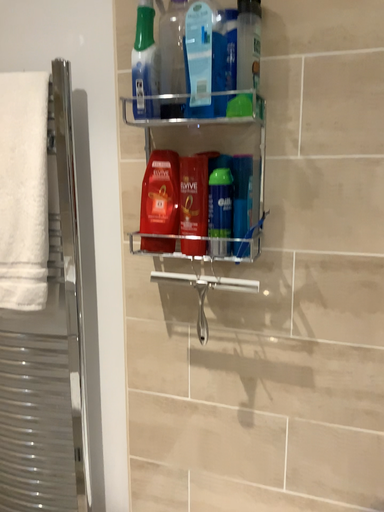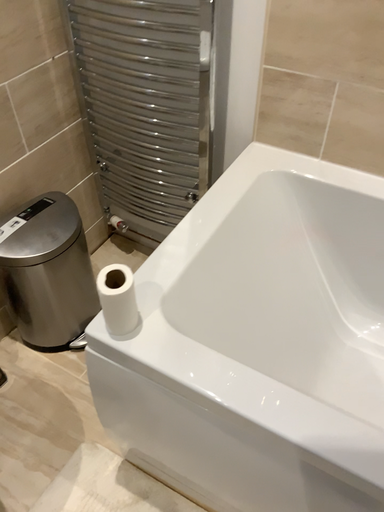
Question: Which way did the camera rotate in the video?

Choices:
 (A) rotated upward
 (B) rotated downward

Answer: (B)